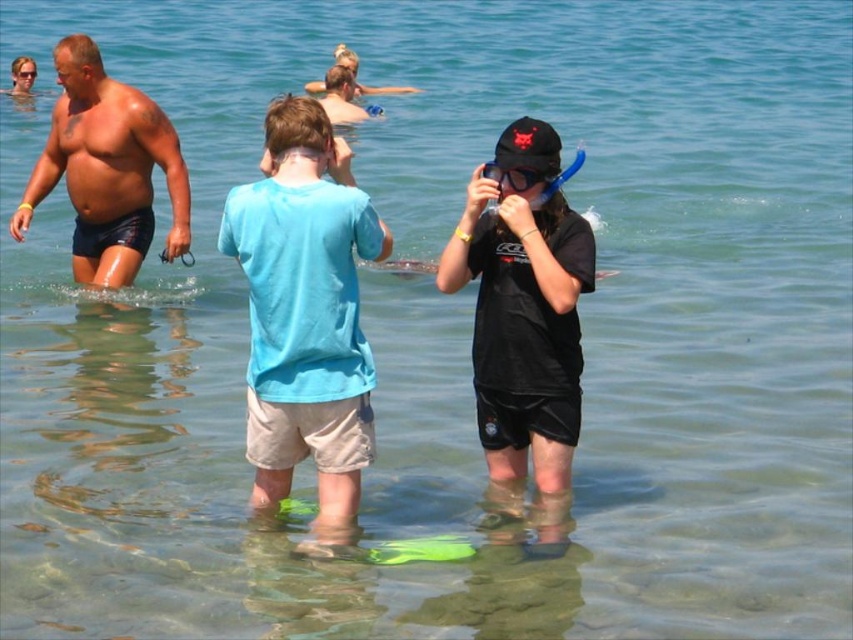
Question: Can you confirm if light blue cotton shirt at center is wider than shiny blue shorts at left?

Choices:
 (A) yes
 (B) no

Answer: (B)

Question: Is light blue cotton shirt at center positioned in front of transparent rubber snorkel at center?

Choices:
 (A) no
 (B) yes

Answer: (B)

Question: Which point is closer to the camera taking this photo?

Choices:
 (A) (492, 161)
 (B) (88, 228)
 (C) (476, 211)
 (D) (306, 266)

Answer: (D)

Question: Which of the following is the farthest from the observer?

Choices:
 (A) light blue cotton shirt at center
 (B) black matte snorkel at center

Answer: (B)

Question: Among these points, which one is farthest from the camera?

Choices:
 (A) (132, 253)
 (B) (361, 196)
 (C) (519, 179)

Answer: (A)

Question: In this image, where is black matte snorkel at center located relative to transparent rubber snorkel at center?

Choices:
 (A) below
 (B) above

Answer: (A)